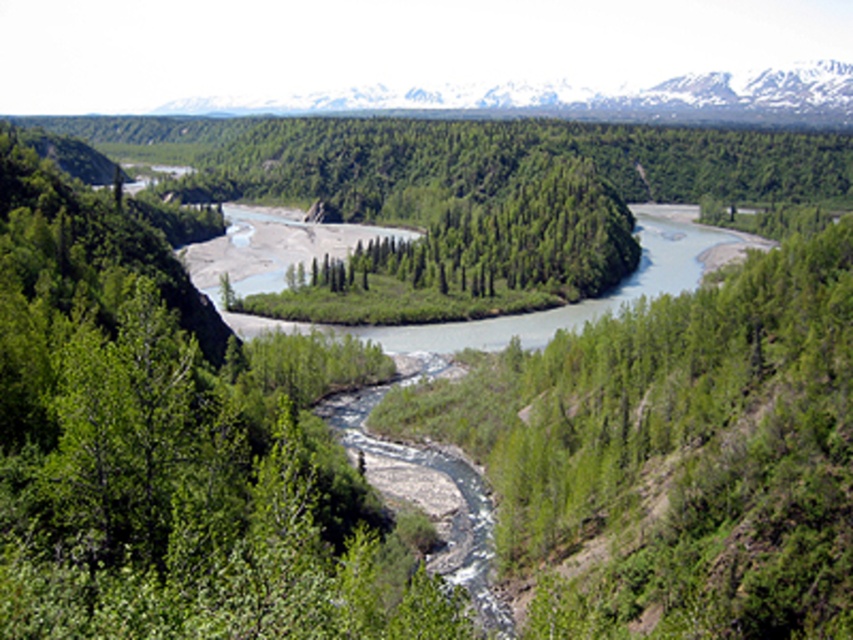
You are a hiker planning to take a photo of the snowy granite mountains at upper center. Based on their position in the image, what coordinates should you aim your camera at?

The snowy granite mountains at upper center are located at coordinates point (x=575, y=99), so you should aim your camera at that position to capture them.

You are an outdoor adventurer standing at the edge of the riverbank. You want to hike towards the snowy granite mountains at upper center and the green leafy trees at center. Which one will you reach first?

You will reach the green leafy trees at center first because they are closer to you than the snowy granite mountains at upper center, which are further away.

You are standing at the point with coordinates point (575,99) in the image. What geographical feature do you see in front of you?

The point (575,99) corresponds to snowy granite mountains at upper center, so you would see snowy granite mountains in front of you.